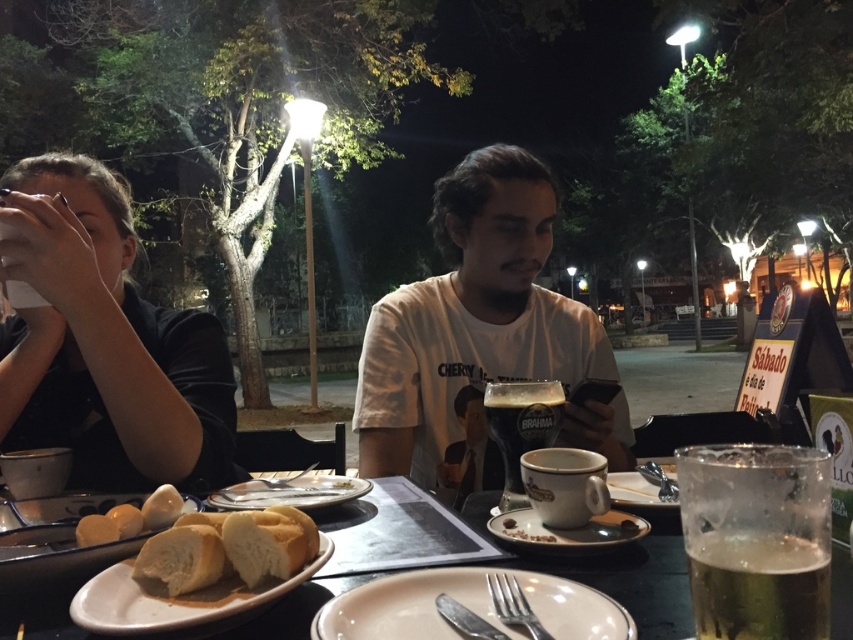
Question: Observing the image, what is the correct spatial positioning of black matte shirt at left in reference to golden matte bread at lower left?

Choices:
 (A) right
 (B) left

Answer: (B)

Question: Where is porcelain plate at center located in relation to white soft bread at lower left in the image?

Choices:
 (A) right
 (B) left

Answer: (A)

Question: Estimate the real-world distances between objects in this image. Which object is farther from the matte black shirt at center?

Choices:
 (A) dark amber glass at center
 (B) white ceramic plate at center

Answer: (B)

Question: From the image, what is the correct spatial relationship of white soft bread at lower left in relation to white matte plate at lower left?

Choices:
 (A) left
 (B) right

Answer: (A)

Question: Estimate the real-world distances between objects in this image. Which object is farther from the matte black shirt at center?

Choices:
 (A) white cotton t-shirt at center
 (B) matte white plate at lower right
 (C) matte ceramic plate at center

Answer: (C)

Question: Which point is farther from the camera taking this photo?

Choices:
 (A) (120, 566)
 (B) (312, 506)
 (C) (325, 618)
 (D) (512, 230)

Answer: (D)